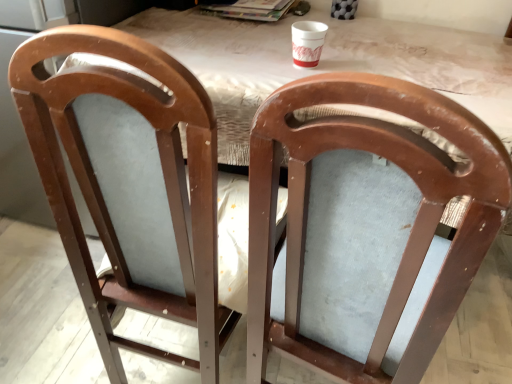
Question: Is matte wood chair at center, the second chair in the left-to-right sequence, oriented towards matte wood chair at center, arranged as the 1th chair when viewed from the left?

Choices:
 (A) yes
 (B) no

Answer: (B)

Question: Is matte wood chair at center, the second chair in the left-to-right sequence, turned away from matte wood chair at center, placed as the 2th chair when sorted from right to left?

Choices:
 (A) no
 (B) yes

Answer: (A)

Question: Is matte wood chair at center, the second chair in the left-to-right sequence, wider than matte wood chair at center, placed as the 2th chair when sorted from right to left?

Choices:
 (A) no
 (B) yes

Answer: (B)

Question: Can you confirm if matte wood chair at center, the second chair in the left-to-right sequence, is bigger than matte wood chair at center, arranged as the 1th chair when viewed from the left?

Choices:
 (A) no
 (B) yes

Answer: (A)

Question: Does matte wood chair at center, which ranks as the 1th chair in right-to-left order, appear on the left side of matte wood chair at center, arranged as the 1th chair when viewed from the left?

Choices:
 (A) no
 (B) yes

Answer: (A)

Question: From the image's perspective, is white paper cup at upper center positioned above or below matte wood chair at center, arranged as the 1th chair when viewed from the left?

Choices:
 (A) above
 (B) below

Answer: (A)

Question: In the image, is white paper cup at upper center positioned in front of or behind matte wood chair at center, placed as the 2th chair when sorted from right to left?

Choices:
 (A) front
 (B) behind

Answer: (B)

Question: Is white paper cup at upper center wider or thinner than matte wood chair at center, arranged as the 1th chair when viewed from the left?

Choices:
 (A) thin
 (B) wide

Answer: (A)

Question: Does point (307, 34) appear closer or farther from the camera than point (23, 62)?

Choices:
 (A) closer
 (B) farther

Answer: (B)

Question: Considering the positions of point (321, 49) and point (219, 137), is point (321, 49) closer or farther from the camera than point (219, 137)?

Choices:
 (A) closer
 (B) farther

Answer: (B)

Question: Is white paper cup at upper center taller or shorter than matte wood table at center?

Choices:
 (A) short
 (B) tall

Answer: (A)

Question: From a real-world perspective, is white paper cup at upper center positioned above or below matte wood table at center?

Choices:
 (A) below
 (B) above

Answer: (B)

Question: Choose the correct answer: Is white paper cup at upper center inside matte wood table at center or outside it?

Choices:
 (A) outside
 (B) inside

Answer: (A)

Question: Considering their positions, is matte wood chair at center, arranged as the 1th chair when viewed from the left, located in front of or behind matte wood chair at center, which ranks as the 1th chair in right-to-left order?

Choices:
 (A) behind
 (B) front

Answer: (A)

Question: Looking at the image, does matte wood chair at center, placed as the 2th chair when sorted from right to left, seem bigger or smaller compared to matte wood chair at center, which ranks as the 1th chair in right-to-left order?

Choices:
 (A) big
 (B) small

Answer: (A)